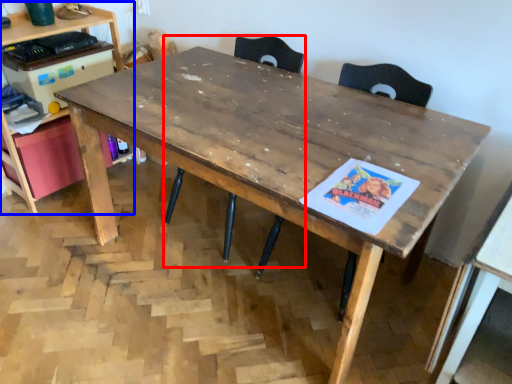
Question: Which point is further to the camera, swivel chair (highlighted by a red box) or computer desk (highlighted by a blue box)?

Choices:
 (A) swivel chair
 (B) computer desk

Answer: (B)